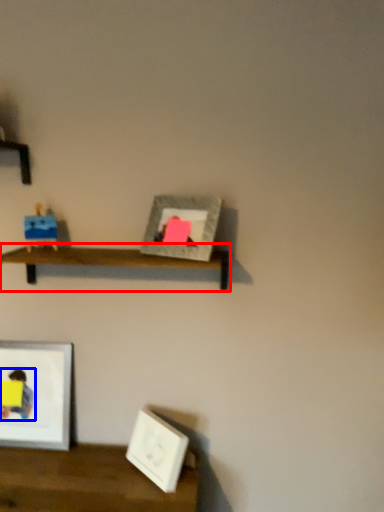
Question: Among these objects, which one is farthest to the camera, shelf (highlighted by a red box) or person (highlighted by a blue box)?

Choices:
 (A) shelf
 (B) person

Answer: (B)